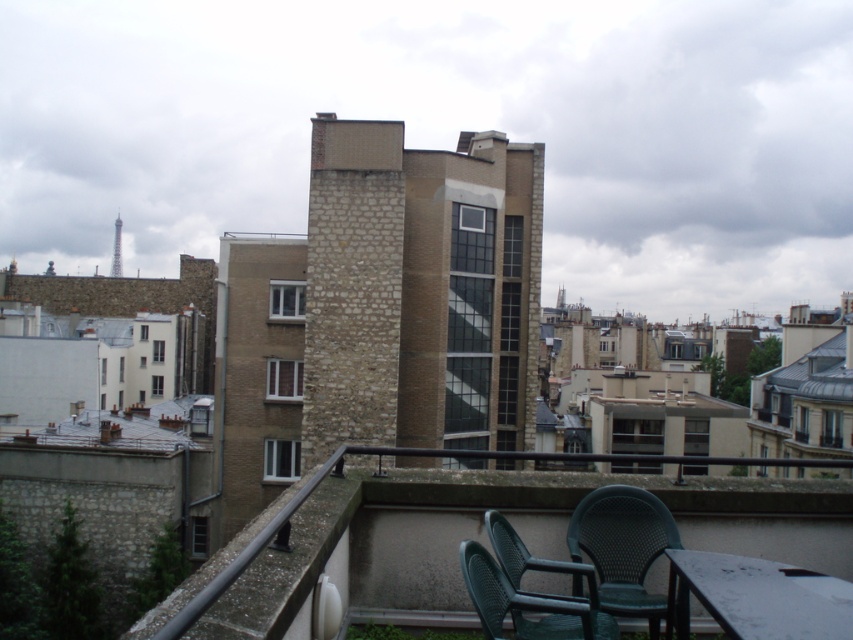
You are standing on the rooftop terrace and want to move from the green plastic chairs at lower right to the brown stone chimney at center. Which direction should you move to reach it?

To reach the brown stone chimney at center from the green plastic chairs at lower right, you should move upward since the green plastic chairs at lower right is located below the brown stone chimney at center.

You are planning to place a large potted plant on the terrace. The potted plant requires a space of at least 1.2 meters in width. Given the white glossy table at lower right and the green wicker chair at lower right, which object would you consider moving to accommodate the plant?

The white glossy table at lower right is bigger than the green wicker chair at lower right, so moving the green wicker chair at lower right would free up less space. Therefore, you should move the white glossy table at lower right to accommodate the plant since it occupies more area.

You are standing on the rooftop terrace and want to locate the brown stone chimney at center. Based on the coordinates provided, where exactly would you find it?

The brown stone chimney at center is located at point coordinates (352, 284).